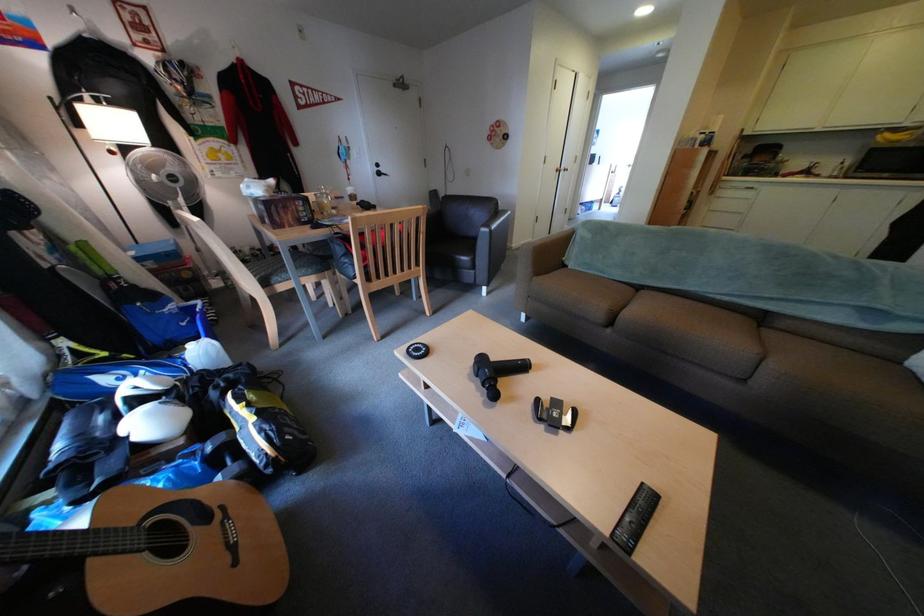
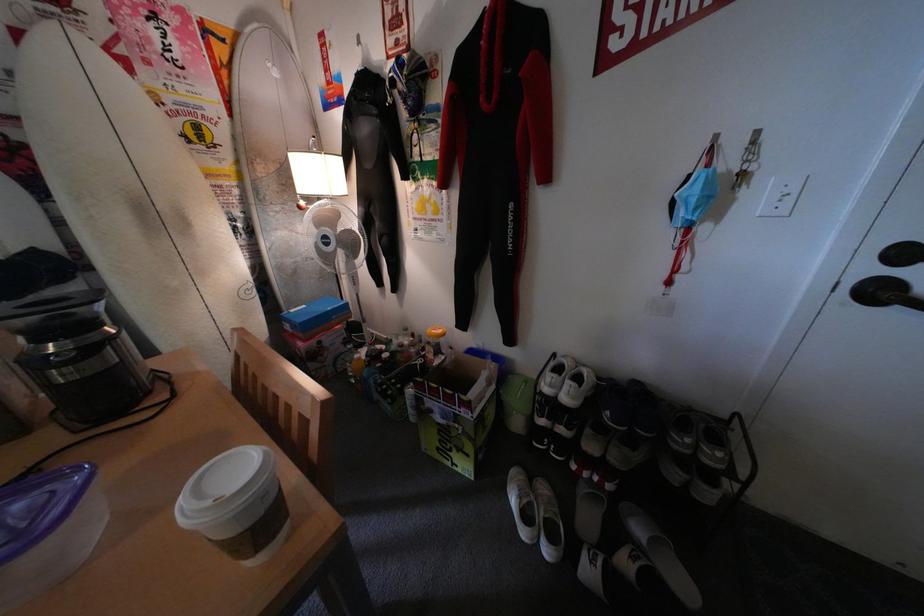
Locate, in the second image, the point that corresponds to (x=359, y=145) in the first image.

(744, 161)